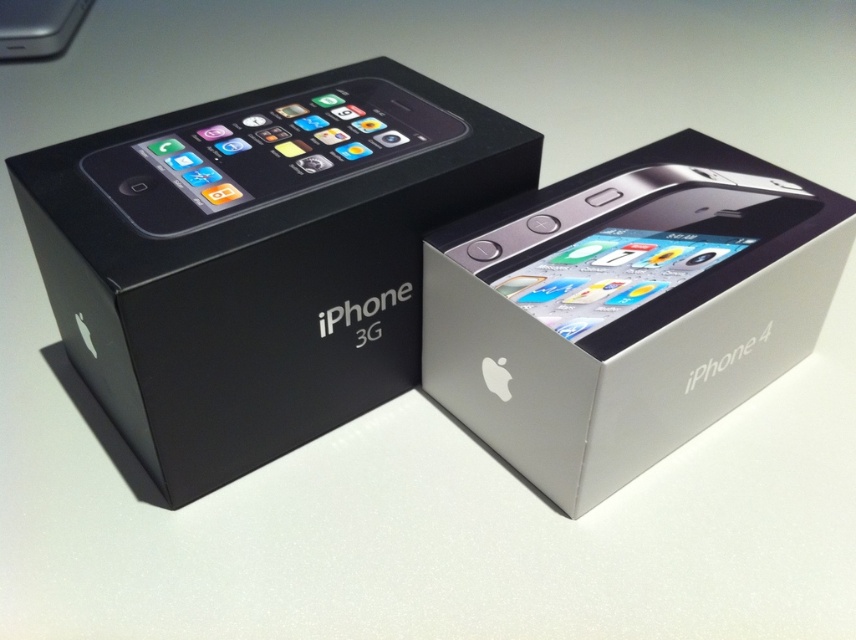
Question: Does black matte iphone 3g box at left lie behind matte black iphone at upper left?

Choices:
 (A) yes
 (B) no

Answer: (B)

Question: Considering the real-world distances, which object is closest to the silver metallic iphone 4 at center?

Choices:
 (A) black matte iphone 3g box at left
 (B) matte black iphone at upper left
 (C) silver metallic ipod at upper left

Answer: (A)

Question: Estimate the real-world distances between objects in this image. Which object is closer to the silver metallic iphone 4 at center?

Choices:
 (A) silver metallic ipod at upper left
 (B) matte black iphone at upper left
 (C) black matte iphone 3g box at left

Answer: (C)

Question: Which point is closer to the camera taking this photo?

Choices:
 (A) (455, 132)
 (B) (480, 358)
 (C) (54, 13)

Answer: (B)

Question: Can you confirm if silver metallic iphone 4 at center is positioned to the left of silver metallic ipod at upper left?

Choices:
 (A) no
 (B) yes

Answer: (A)

Question: Does black matte iphone 3g box at left lie behind silver metallic ipod at upper left?

Choices:
 (A) no
 (B) yes

Answer: (A)